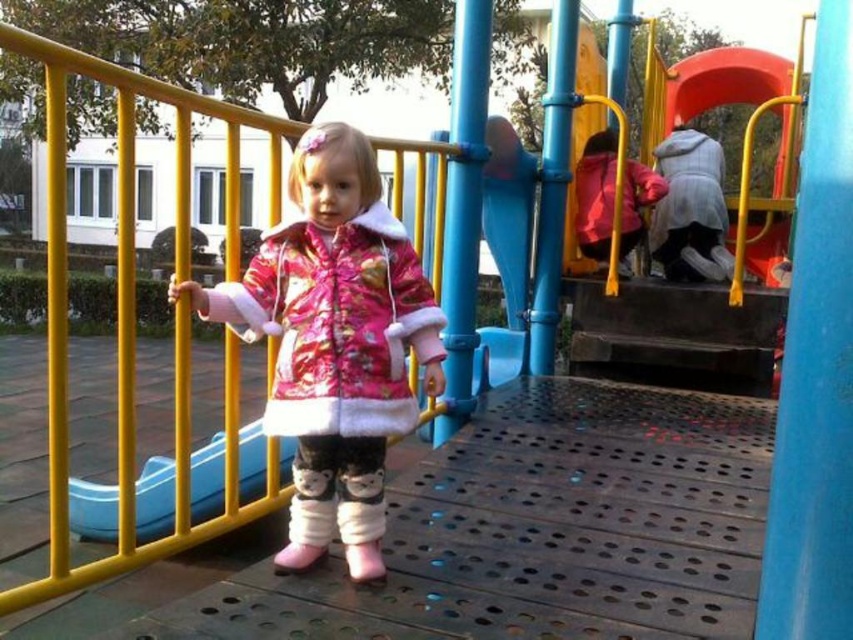
Question: Which of the following is the closest to the observer?

Choices:
 (A) fluffy pink coat at center
 (B) fluffy pink jacket at center
 (C) gray fuzzy jacket at upper right

Answer: (A)

Question: Which point is farther from the camera taking this photo?

Choices:
 (A) (660, 168)
 (B) (143, 506)
 (C) (601, 177)
 (D) (273, 433)

Answer: (A)

Question: Is blue plastic slide at center behind matte pink jacket at upper right?

Choices:
 (A) yes
 (B) no

Answer: (B)

Question: Estimate the real-world distances between objects in this image. Which object is farther from the matte pink jacket at upper right?

Choices:
 (A) gray fuzzy jacket at upper right
 (B) fluffy pink coat at center
 (C) blue plastic slide at center

Answer: (B)

Question: Is fluffy pink coat at center thinner than gray fuzzy jacket at upper right?

Choices:
 (A) no
 (B) yes

Answer: (A)

Question: Can you confirm if gray fuzzy jacket at upper right is positioned to the right of matte pink jacket at upper right?

Choices:
 (A) yes
 (B) no

Answer: (A)